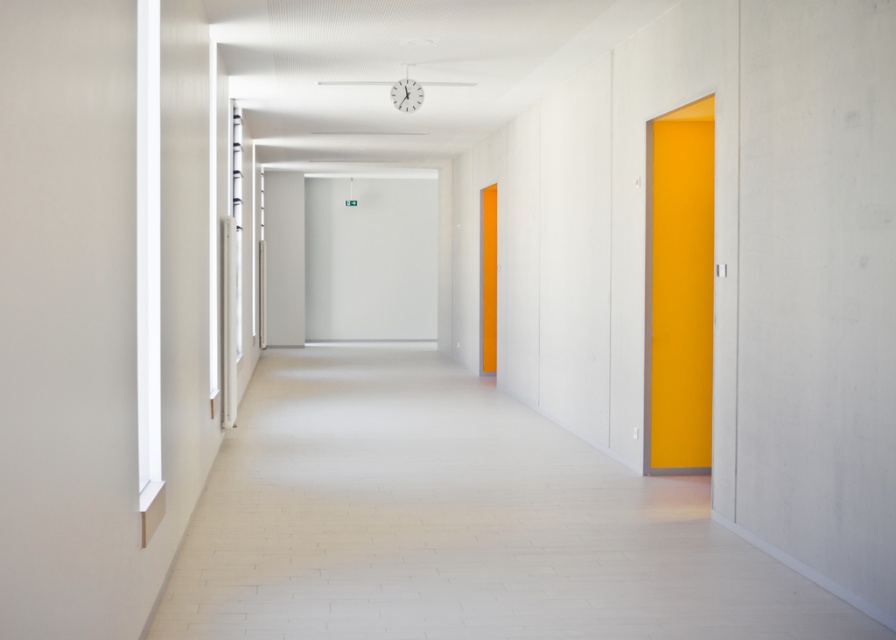
Question: Which of the following is the closest to the observer?

Choices:
 (A) yellow matte door at right
 (B) orange matte door at center

Answer: (A)

Question: Is yellow matte door at right wider than orange matte door at center?

Choices:
 (A) no
 (B) yes

Answer: (B)

Question: Which of the following is the farthest from the observer?

Choices:
 (A) [673, 316]
 (B) [487, 250]

Answer: (B)

Question: Does yellow matte door at right have a greater width compared to orange matte door at center?

Choices:
 (A) no
 (B) yes

Answer: (B)

Question: Does yellow matte door at right have a lesser width compared to orange matte door at center?

Choices:
 (A) yes
 (B) no

Answer: (B)